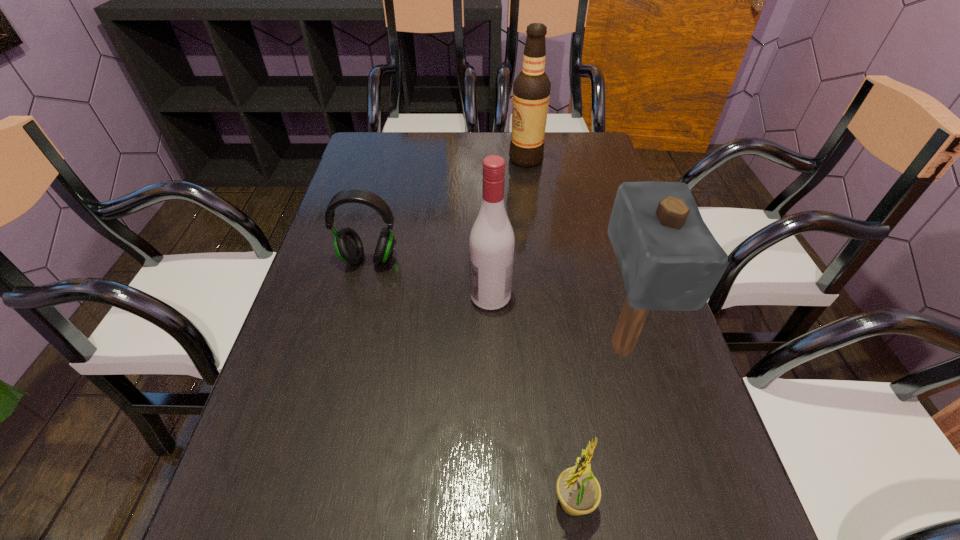
Find the location of a particular element. The image size is (960, 540). vacant space in between the nearest object and the farthest object is located at coordinates (549, 330).

This screenshot has height=540, width=960. I want to click on free space between the nearer alcohol and the mallet, so click(556, 321).

This screenshot has width=960, height=540. Identify the location of empty location between the nearest object and the second farthest object. (470, 380).

Where is `free point between the fourth nearest object and the farthest object`? This screenshot has height=540, width=960. free point between the fourth nearest object and the farthest object is located at coordinates (447, 209).

Where is `vacant area that lies between the leftmost object and the farther alcohol`? vacant area that lies between the leftmost object and the farther alcohol is located at coordinates (447, 209).

Identify which object is the second closest to the nearest object. Please provide its 2D coordinates. Your answer should be formatted as a tuple, i.e. [(x, y)], where the tuple contains the x and y coordinates of a point satisfying the conditions above.

[(492, 241)]

Locate which object is the second closest to the fourth nearest object. Please provide its 2D coordinates. Your answer should be formatted as a tuple, i.e. [(x, y)], where the tuple contains the x and y coordinates of a point satisfying the conditions above.

[(669, 259)]

Identify the location of free space that satisfies the following two spatial constraints: 1. on the label of the farthest object; 2. on the left side of the mallet. (551, 346).

Locate an element on the screen. The width and height of the screenshot is (960, 540). free space that satisfies the following two spatial constraints: 1. on the back side of the rightmost object; 2. on the label of the fourth object from right to left is located at coordinates (608, 296).

You are a GUI agent. You are given a task and a screenshot of the screen. Output one action in this format:
    pyautogui.click(x=<x>, y=<y>)
    Task: Click on the vacant space that satisfies the following two spatial constraints: 1. on the front side of the rightmost object; 2. on the face of the sunflower
    
    Given the screenshot: What is the action you would take?
    pyautogui.click(x=663, y=502)